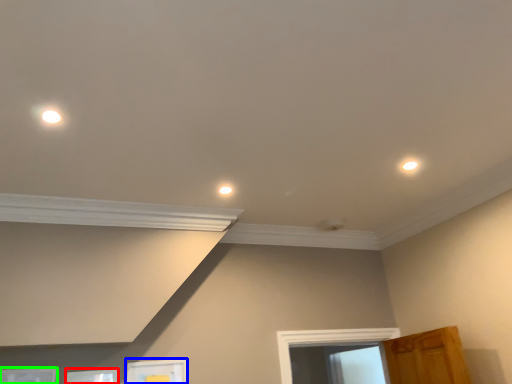
Question: Which object is the closest to the picture frame (highlighted by a red box)? Choose among these: picture frame (highlighted by a blue box) or picture frame (highlighted by a green box).

Choices:
 (A) picture frame
 (B) picture frame

Answer: (B)